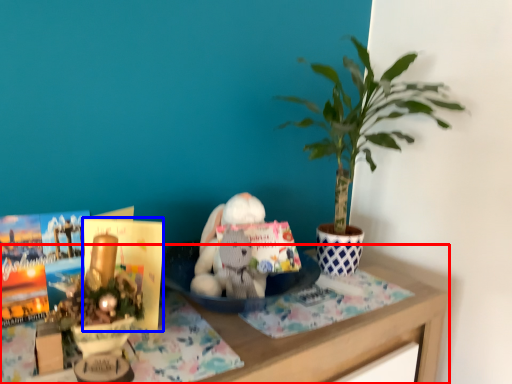
Question: Which point is closer to the camera, table (highlighted by a red box) or paperback book (highlighted by a blue box)?

Choices:
 (A) table
 (B) paperback book

Answer: (A)